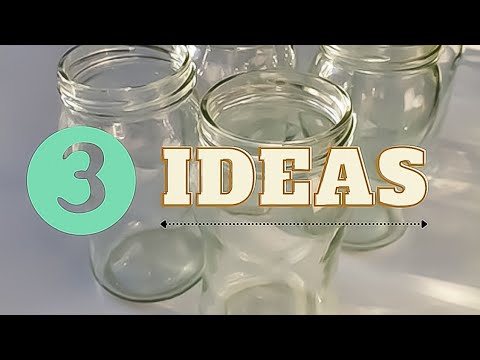
I want to click on glass jar, so click(x=151, y=102), click(x=272, y=112), click(x=238, y=57), click(x=364, y=72).